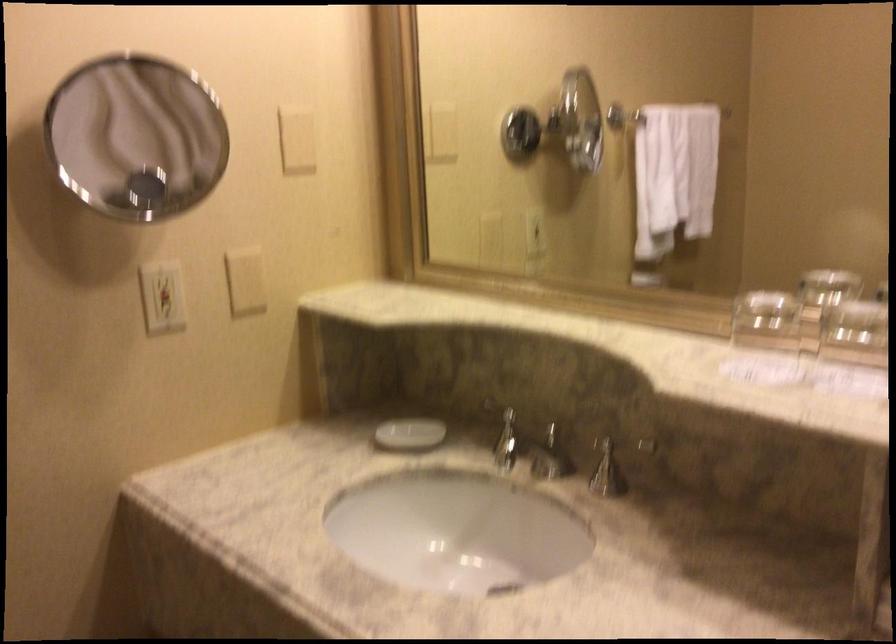
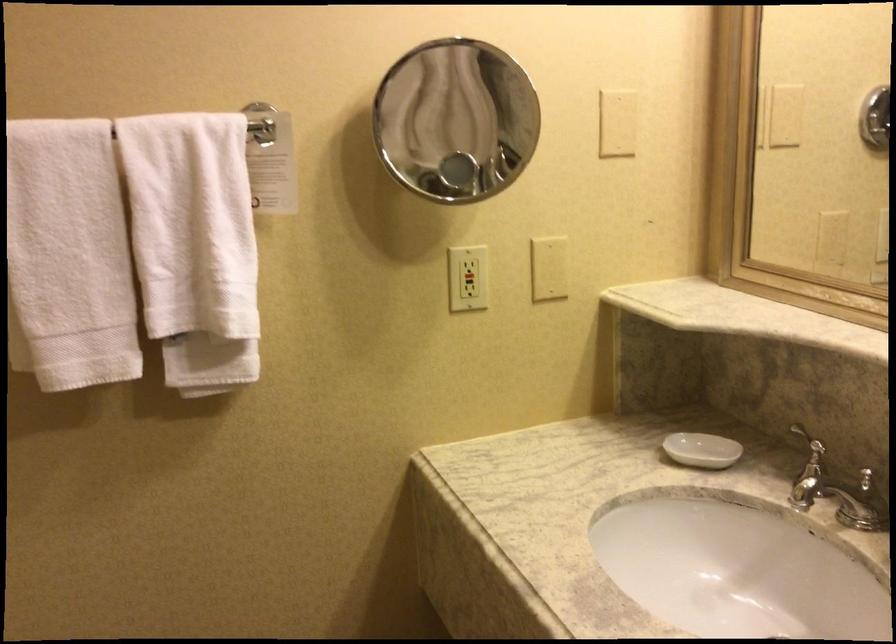
The point at (x=161, y=297) is marked in the first image. Where is the corresponding point in the second image?

(467, 278)